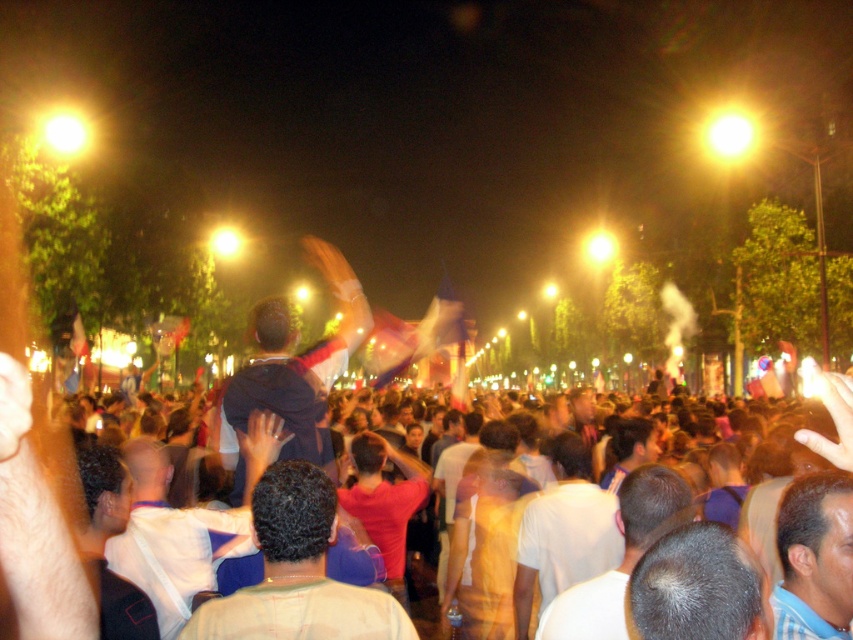
You are a photographer at the event and want to capture a photo that includes both the gray matte hair at center and the light blue striped shirt at center. Which object should you focus on first to ensure both are in the frame?

You should focus on the light blue striped shirt at center first because the gray matte hair at center is located below it, ensuring both will be captured in the frame.

You are standing in the crowd at the nighttime event and want to take a photo of both the point at coordinates (526,627) and the point at coordinates (370,492). Which point will appear larger in your camera view?

Point (526,627) is closer to the camera than point (370,492), so it will appear larger in the photo.

You are a photographer standing at the edge of the crowd trying to capture a clear shot of the red matte shirt at center. Based on its position coordinates, can you estimate whether the shirt is positioned closer to the front or the back of the crowd?

The red matte shirt at center is located at point coordinates, so based on standard image coordinate systems where the origin is typically at the top left corner, the shirt is positioned closer to the front of the crowd since the y coordinate of 0.451 places it lower in the image, which corresponds to a more forward position in the scene.